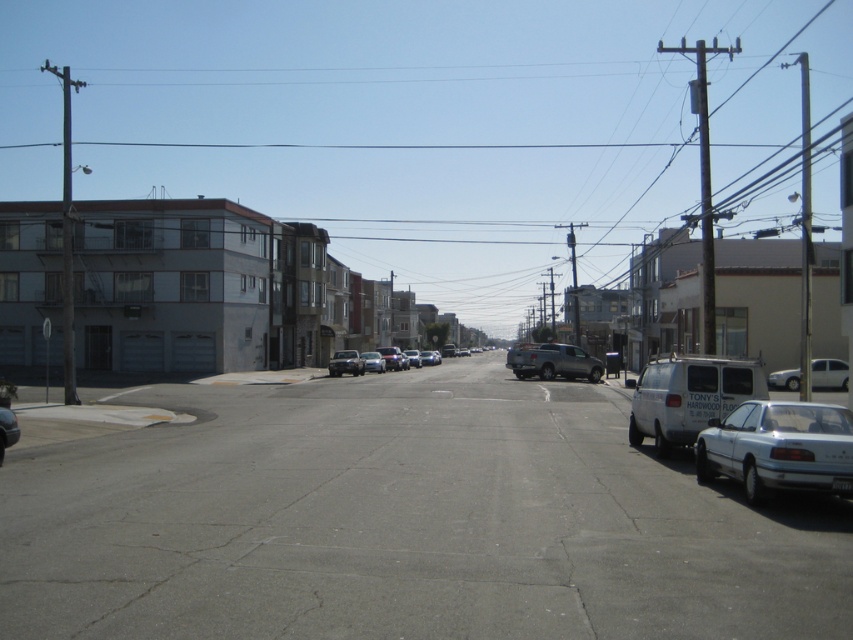
Does metallic silver sedan at center have a lesser width compared to silver metallic sedan at center?

No, metallic silver sedan at center is not thinner than silver metallic sedan at center.

Where is `metallic silver sedan at center`? Image resolution: width=853 pixels, height=640 pixels. metallic silver sedan at center is located at coordinates (345, 362).

Is point (827, 376) positioned behind point (381, 364)?

No, (827, 376) is in front of (381, 364).

Between white matte sedan at right and silver metallic sedan at center, which one has more height?

silver metallic sedan at center is taller.

What do you see at coordinates (828, 372) in the screenshot? The width and height of the screenshot is (853, 640). I see `white matte sedan at right` at bounding box center [828, 372].

I want to click on white matte sedan at right, so click(828, 372).

Is shiny blue car at lower left taller than metallic silver sedan at center?

Incorrect, shiny blue car at lower left's height is not larger of metallic silver sedan at center's.

Is shiny blue car at lower left to the left of metallic silver sedan at center from the viewer's perspective?

Correct, you'll find shiny blue car at lower left to the left of metallic silver sedan at center.

Is point (6, 435) more distant than point (354, 362)?

No, it is in front of (354, 362).

Where is `shiny blue car at lower left`? Image resolution: width=853 pixels, height=640 pixels. shiny blue car at lower left is located at coordinates (6, 426).